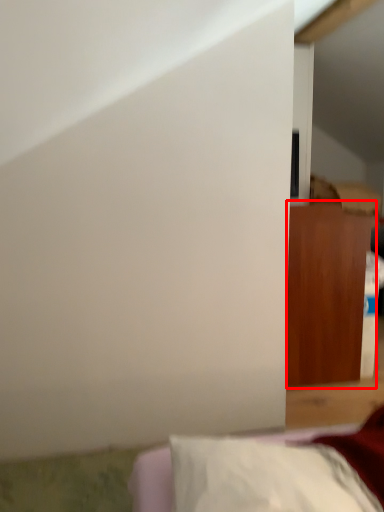
Question: From the image's perspective, considering the relative positions of furniture (annotated by the red box) and furniture in the image provided, where is furniture (annotated by the red box) located with respect to the staircase?

Choices:
 (A) above
 (B) below

Answer: (A)